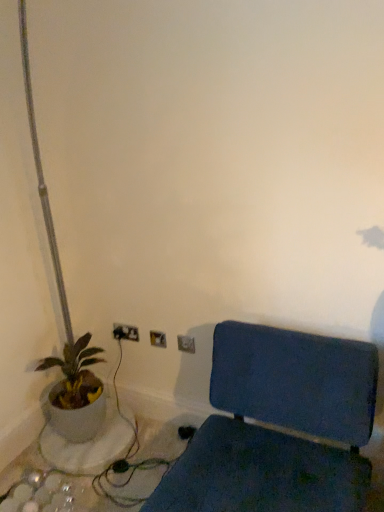
Question: From a real-world perspective, is blue fabric chair at lower right physically located above or below metallic silver electric outlet at upper center, which is the 3th electric outlet in left-to-right order?

Choices:
 (A) above
 (B) below

Answer: (B)

Question: Considering their positions, is blue fabric chair at lower right located in front of or behind metallic silver electric outlet at upper center, which is the 3th electric outlet in left-to-right order?

Choices:
 (A) front
 (B) behind

Answer: (A)

Question: Considering the real-world distances, which object is closest to the metallic silver electric outlet at upper center, the third electric outlet when ordered from back to front?

Choices:
 (A) blue fabric chair at lower right
 (B) matte white pot at left
 (C) metallic silver electric outlet at center, the second electric outlet positioned from the back
 (D) metallic silver electric outlet at lower center, placed as the 1th electric outlet when sorted from back to front

Answer: (C)

Question: Which object is the closest to the matte white pot at left?

Choices:
 (A) metallic silver electric outlet at upper center, acting as the 1th electric outlet starting from the front
 (B) metallic silver electric outlet at center, which is the second electric outlet in front-to-back order
 (C) blue fabric chair at lower right
 (D) metallic silver electric outlet at lower center, the third electric outlet in the front-to-back sequence

Answer: (D)